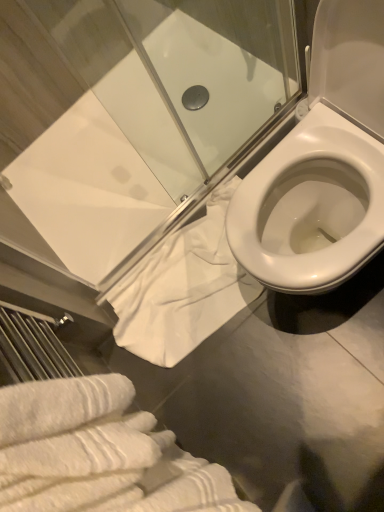
Question: Does point (96, 381) appear closer or farther from the camera than point (0, 29)?

Choices:
 (A) closer
 (B) farther

Answer: (A)

Question: Considering the positions of white textured bath towel at lower left, which is counted as the second bath towel, starting from the back, and transparent glass shower door at upper center in the image, is white textured bath towel at lower left, which is counted as the second bath towel, starting from the back, wider or thinner than transparent glass shower door at upper center?

Choices:
 (A) thin
 (B) wide

Answer: (B)

Question: Which is farther from the transparent glass shower door at upper center?

Choices:
 (A) white cotton towel at lower center, which is the 2th bath towel from front to back
 (B) white textured bath towel at lower left, which is counted as the second bath towel, starting from the back

Answer: (B)

Question: Based on their relative distances, which object is nearer to the white textured bath towel at lower left, which is counted as the second bath towel, starting from the back?

Choices:
 (A) white cotton towel at lower center, which is the 2th bath towel from front to back
 (B) transparent glass shower door at upper center

Answer: (A)